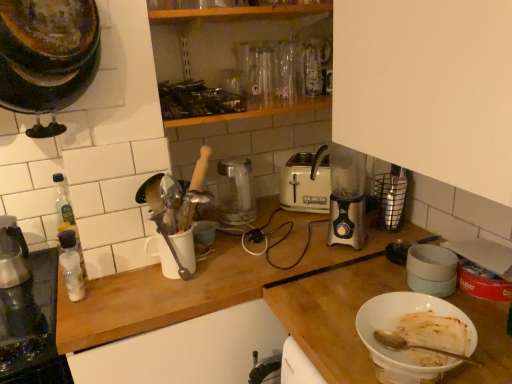
You are a GUI agent. You are given a task and a screenshot of the screen. Output one action in this format:
    pyautogui.click(x=<x>, y=<y>)
    Task: Click on the spots to the right of white plastic bottle at left, the first bottle from the back
    Image resolution: width=512 pixels, height=384 pixels.
    Given the screenshot: What is the action you would take?
    pyautogui.click(x=120, y=278)